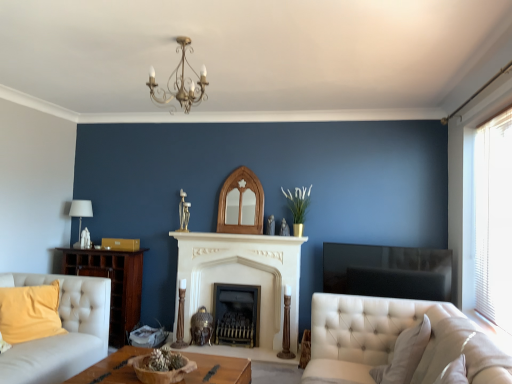
Question: Does white fabric lampshade at left appear on the left side of wooden bowl at center?

Choices:
 (A) yes
 (B) no

Answer: (A)

Question: Is white fabric lampshade at left in front of wooden bowl at center?

Choices:
 (A) no
 (B) yes

Answer: (A)

Question: Is white fabric lampshade at left thinner than wooden bowl at center?

Choices:
 (A) no
 (B) yes

Answer: (B)

Question: Can you see white fabric lampshade at left touching wooden bowl at center?

Choices:
 (A) yes
 (B) no

Answer: (B)

Question: Would you consider white fabric lampshade at left to be distant from wooden bowl at center?

Choices:
 (A) no
 (B) yes

Answer: (B)

Question: Relative to gray fabric pillow at lower right, which is the first pillow from right to left, is white marble fireplace at center in front or behind?

Choices:
 (A) front
 (B) behind

Answer: (B)

Question: Looking at the image, does white marble fireplace at center seem bigger or smaller compared to gray fabric pillow at lower right, acting as the second pillow starting from the left?

Choices:
 (A) small
 (B) big

Answer: (A)

Question: From the image's perspective, is white marble fireplace at center positioned above or below gray fabric pillow at lower right, which is the 2th pillow from back to front?

Choices:
 (A) below
 (B) above

Answer: (B)

Question: From a real-world perspective, is white marble fireplace at center positioned above or below gray fabric pillow at lower right, which is the first pillow from right to left?

Choices:
 (A) above
 (B) below

Answer: (A)

Question: In terms of height, does white stone fireplace at center, which is the second fireplace in right-to-left order, look taller or shorter compared to velvet yellow pillow at lower left, the second pillow when ordered from front to back?

Choices:
 (A) tall
 (B) short

Answer: (A)

Question: Considering the positions of point (182, 271) and point (8, 337), is point (182, 271) closer or farther from the camera than point (8, 337)?

Choices:
 (A) closer
 (B) farther

Answer: (B)

Question: Is white stone fireplace at center, which is the second fireplace in right-to-left order, to the left or to the right of velvet yellow pillow at lower left, marked as the first pillow in a left-to-right arrangement, in the image?

Choices:
 (A) right
 (B) left

Answer: (A)

Question: Is white stone fireplace at center, the first fireplace from the left, in front of or behind velvet yellow pillow at lower left, acting as the first pillow starting from the back, in the image?

Choices:
 (A) behind
 (B) front

Answer: (A)

Question: From a real-world perspective, is white blinds at right physically located above or below white stone fireplace at center, the first fireplace from the left?

Choices:
 (A) below
 (B) above

Answer: (B)

Question: Visually, is white blinds at right positioned to the left or to the right of white stone fireplace at center, the first fireplace from the left?

Choices:
 (A) right
 (B) left

Answer: (A)